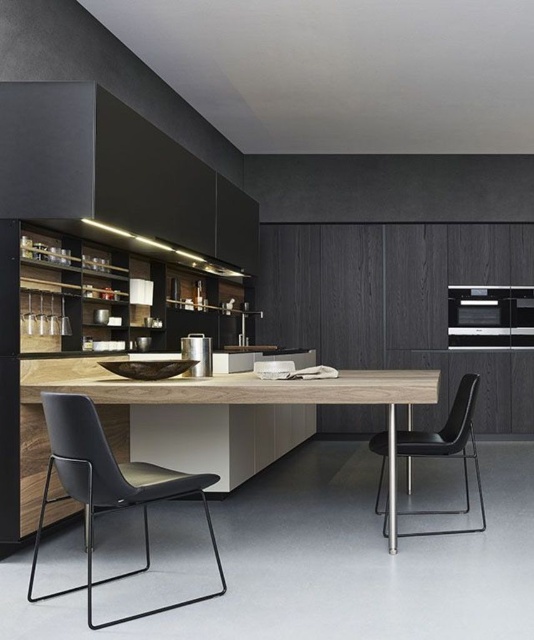
You are standing at the entrance of the kitchen and want to sit down. There is a black leather chair at lower left. Based on its position, can you estimate whether it is near the entrance or further away from it?

The black leather chair at lower left is located at point (107, 488), which suggests it is positioned closer to the entrance since lower coordinates typically indicate proximity to the viewer. Therefore, the chair is likely near the entrance.

You are a chef preparing a meal in the modern kitchen described. You need to place a hot pan on the light wood countertop at center. Is the matte black exhaust hood at upper left located above where you would place the pan?

Yes, the matte black exhaust hood at upper left is positioned over the light wood countertop at center, so placing the hot pan there would allow the exhaust hood to effectively vent any smoke or steam generated during cooking.